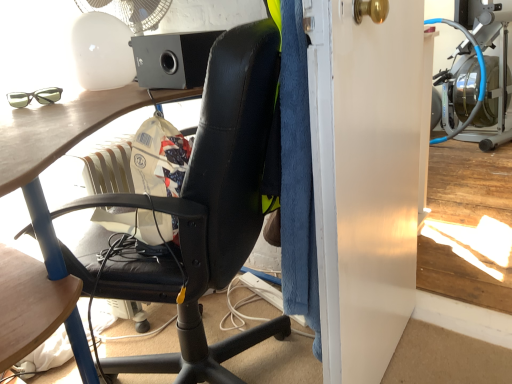
Question: Is white glossy screen door at right wider than black matte speaker at upper center?

Choices:
 (A) no
 (B) yes

Answer: (A)

Question: From a real-world perspective, is white glossy screen door at right below black matte speaker at upper center?

Choices:
 (A) yes
 (B) no

Answer: (A)

Question: Does white glossy screen door at right have a larger size compared to black matte speaker at upper center?

Choices:
 (A) no
 (B) yes

Answer: (B)

Question: Is white glossy screen door at right taller than black matte speaker at upper center?

Choices:
 (A) yes
 (B) no

Answer: (A)

Question: From the image's perspective, does white glossy screen door at right appear lower than black matte speaker at upper center?

Choices:
 (A) no
 (B) yes

Answer: (B)

Question: In the image, is black matte speaker at upper center on the left side or the right side of matte black glasses at upper left?

Choices:
 (A) left
 (B) right

Answer: (B)

Question: From the image's perspective, is black matte speaker at upper center positioned above or below matte black glasses at upper left?

Choices:
 (A) below
 (B) above

Answer: (B)

Question: In terms of height, does black matte speaker at upper center look taller or shorter compared to matte black glasses at upper left?

Choices:
 (A) short
 (B) tall

Answer: (B)

Question: Is point (186, 59) closer or farther from the camera than point (15, 97)?

Choices:
 (A) closer
 (B) farther

Answer: (B)

Question: Considering the positions of matte black glasses at upper left and white glossy screen door at right in the image, is matte black glasses at upper left bigger or smaller than white glossy screen door at right?

Choices:
 (A) small
 (B) big

Answer: (A)

Question: From the image's perspective, is matte black glasses at upper left located above or below white glossy screen door at right?

Choices:
 (A) below
 (B) above

Answer: (B)

Question: Is point (15, 92) positioned closer to the camera than point (374, 289)?

Choices:
 (A) closer
 (B) farther

Answer: (B)

Question: Looking at their shapes, would you say matte black glasses at upper left is wider or thinner than white glossy screen door at right?

Choices:
 (A) wide
 (B) thin

Answer: (A)

Question: Looking at the image, does white glossy screen door at right seem bigger or smaller compared to black matte speaker at upper center?

Choices:
 (A) big
 (B) small

Answer: (A)

Question: In terms of height, does white glossy screen door at right look taller or shorter compared to black matte speaker at upper center?

Choices:
 (A) short
 (B) tall

Answer: (B)